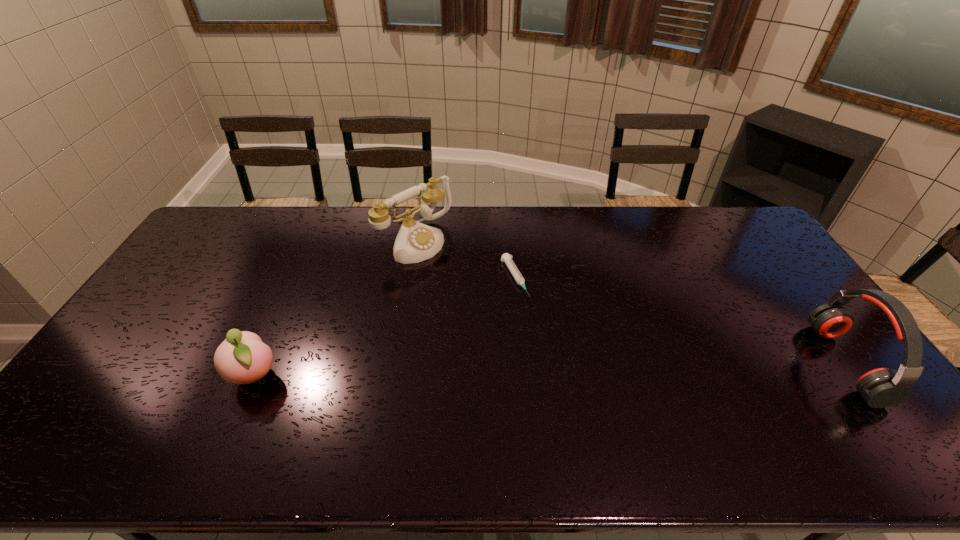
Locate an element on the screen. The width and height of the screenshot is (960, 540). free space on the desktop that is between the third tallest object and the earphone and is positioned on the dial of the second object from left to right is located at coordinates (593, 368).

The width and height of the screenshot is (960, 540). What are the coordinates of `vacant space on the desktop that is between the leftmost object and the earphone and is positioned at the needle end of the second object from right to left` in the screenshot? It's located at (568, 369).